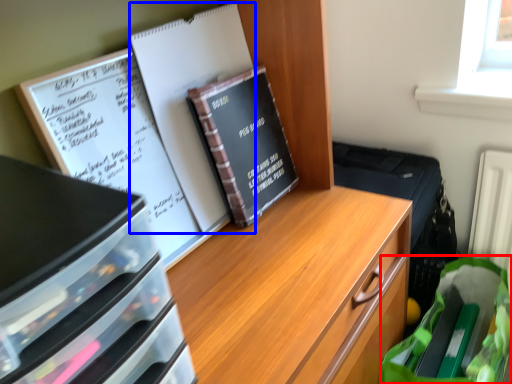
Question: Among these objects, which one is nearest to the camera, grocery bag (highlighted by a red box) or journal (highlighted by a blue box)?

Choices:
 (A) grocery bag
 (B) journal

Answer: (B)